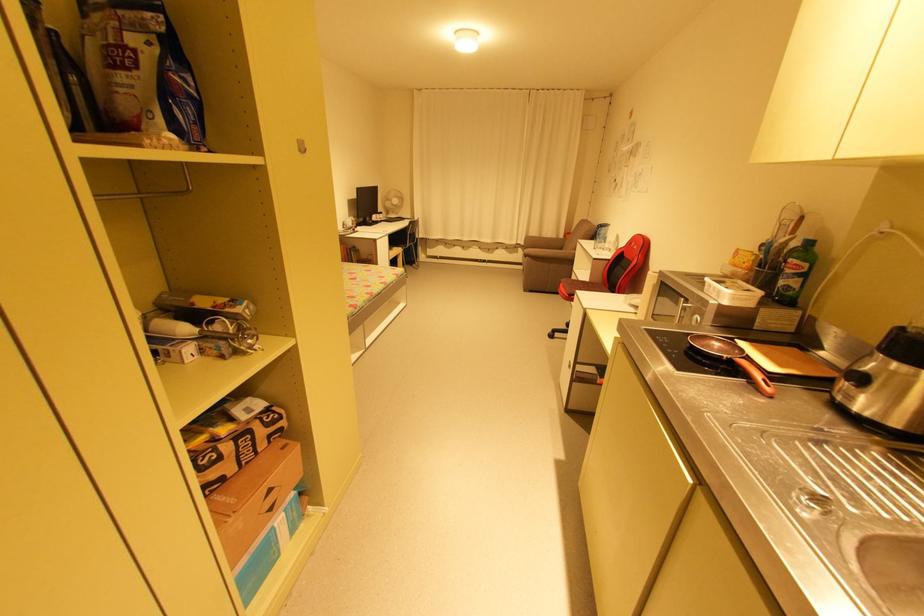
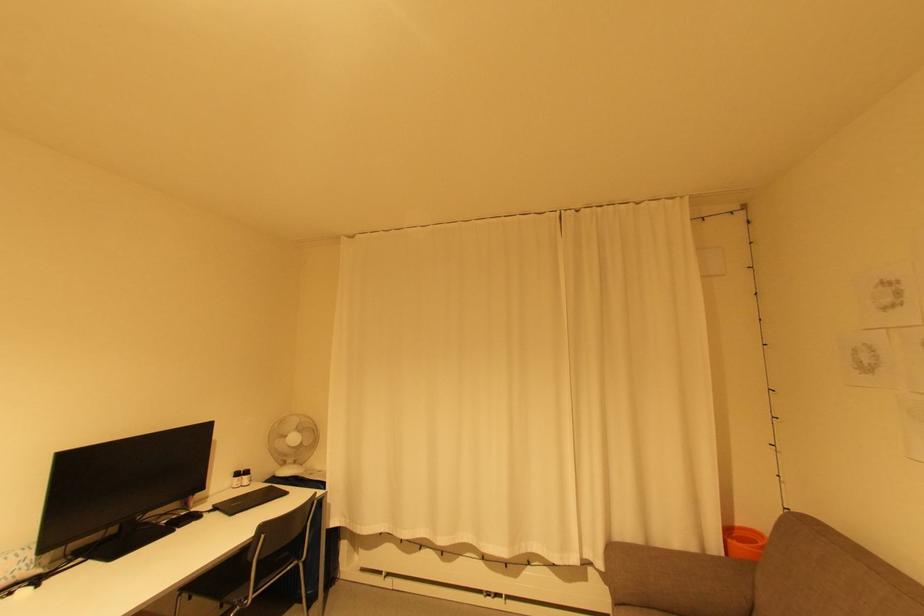
In the second image, find the point that corresponds to point (385, 215) in the first image.

(250, 477)